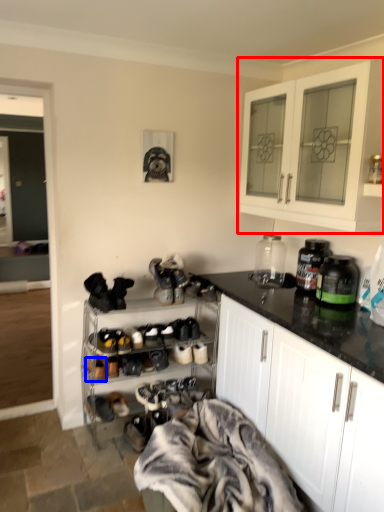
Question: Which object is further to the camera taking this photo, cabinetry (highlighted by a red box) or shoe (highlighted by a blue box)?

Choices:
 (A) cabinetry
 (B) shoe

Answer: (B)